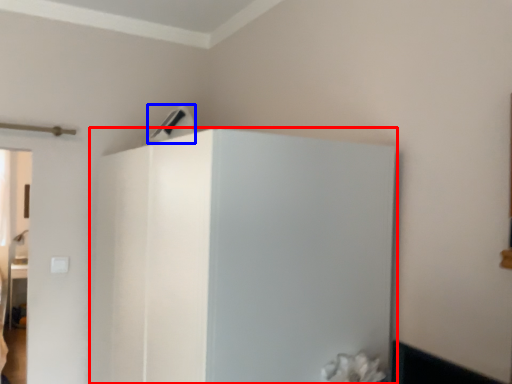
Question: Which of the following is the farthest to the observer, fridge (highlighted by a red box) or appliance (highlighted by a blue box)?

Choices:
 (A) fridge
 (B) appliance

Answer: (B)